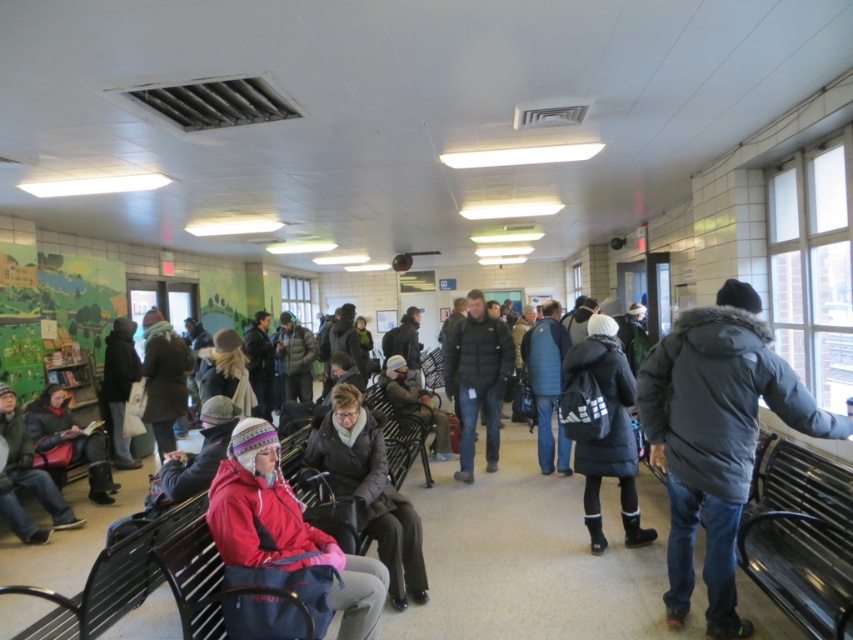
In the scene shown: You are a passenger in the waiting area and want to sit next to the dark gray jacket at left. Are you currently standing to the left or right of the matte black jacket at center?

The dark gray jacket at left is to the left of the matte black jacket at center, so if you want to sit next to the dark gray jacket at left, you must be standing to the left of the matte black jacket at center.

You are a person standing at the entrance of the waiting area. You see a matte black jacket at lower left and a dark gray knit hat at center. If you want to reach both items to greet the people wearing them, which one would you need to walk towards first based on their positions?

The matte black jacket at lower left is closer to you than the dark gray knit hat at center, so you should walk towards the matte black jacket at lower left first.

You are a person standing in the waiting area and want to borrow a hat from someone. You see the matte black jacket at lower left and the dark gray knit hat at center. Which object is positioned more to the left?

The matte black jacket at lower left is positioned more to the left than the dark gray knit hat at center.